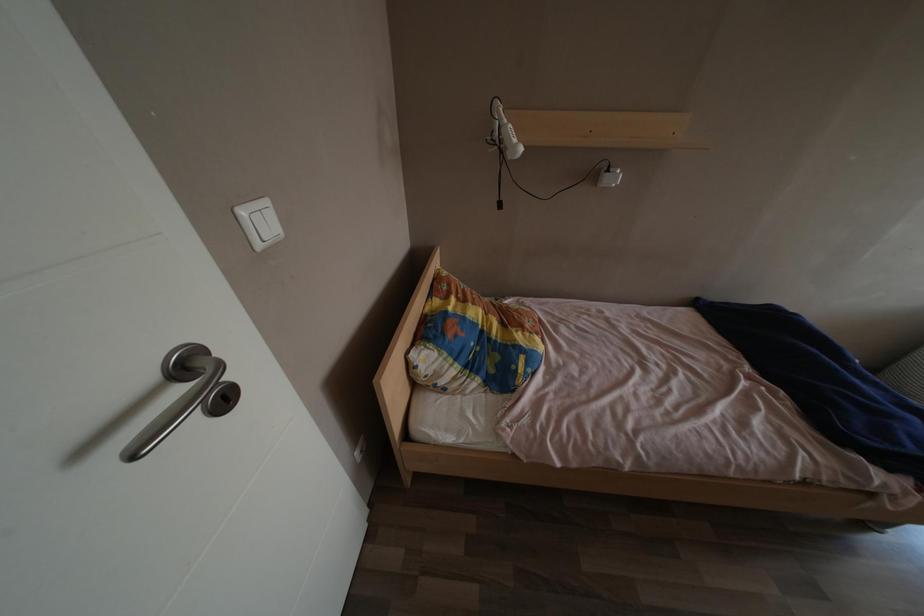
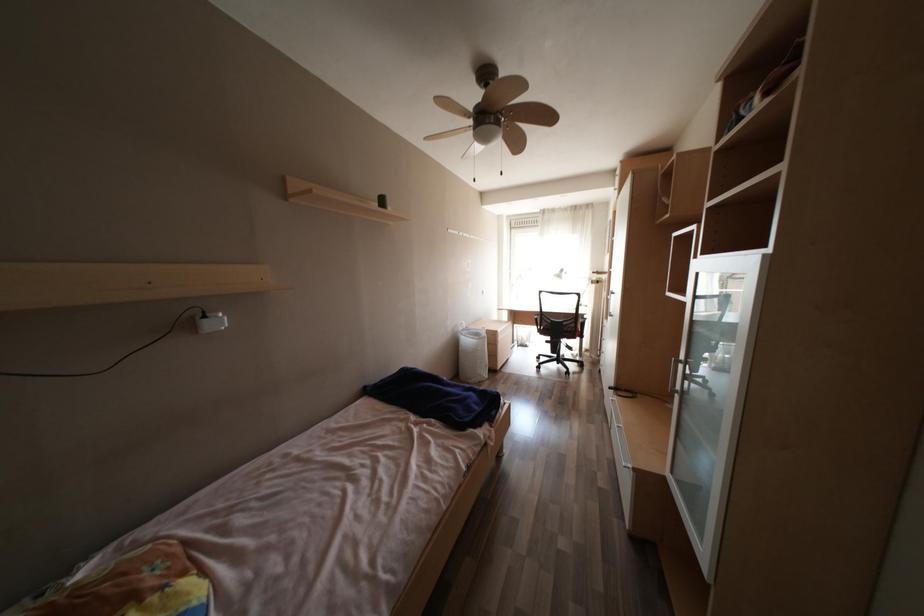
Question: The camera is either moving clockwise (left) or counter-clockwise (right) around the object. The first image is from the beginning of the video and the second image is from the end. Is the camera moving left or right when shooting the video?

Choices:
 (A) Left
 (B) Right

Answer: (A)